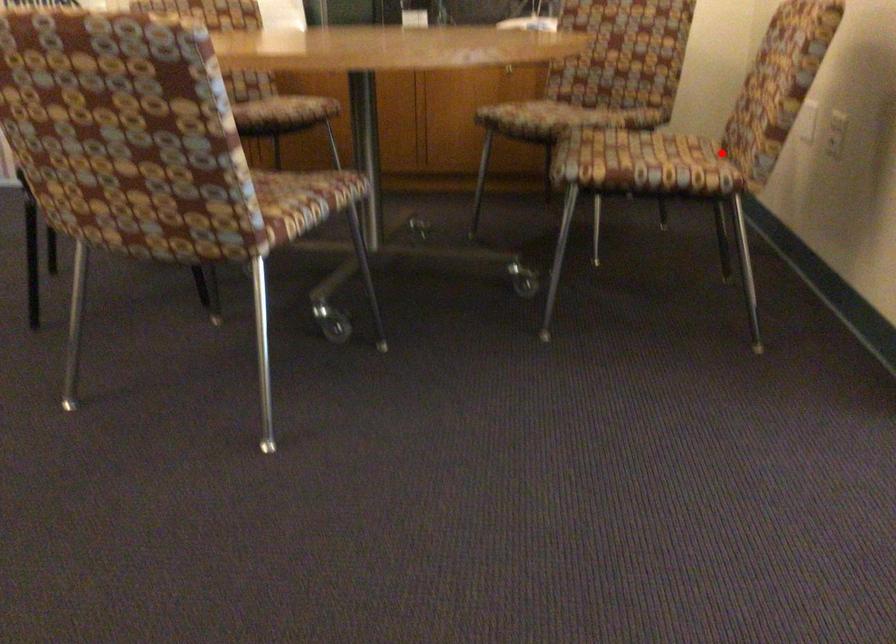
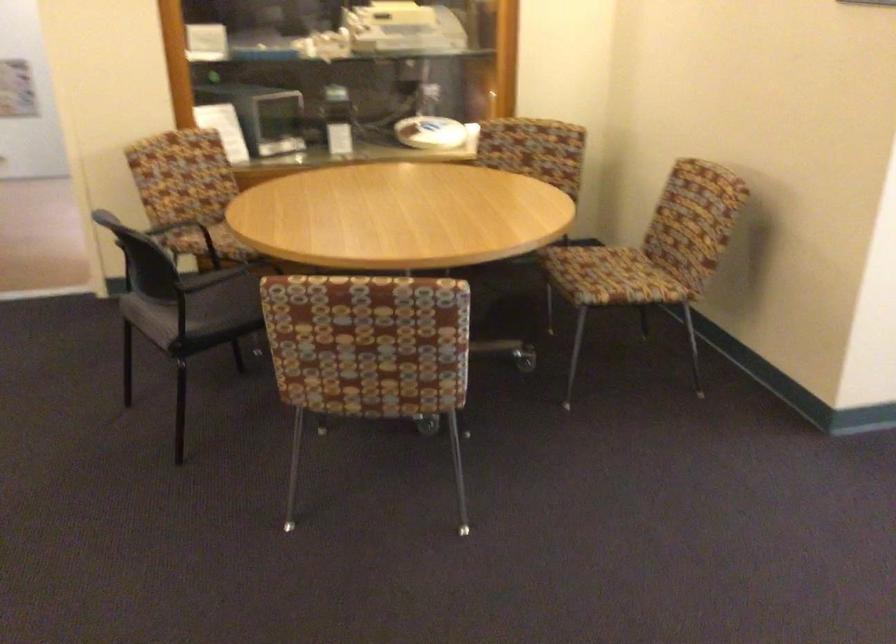
In the second image, find the point that corresponds to the highlighted location in the first image.

(652, 254)